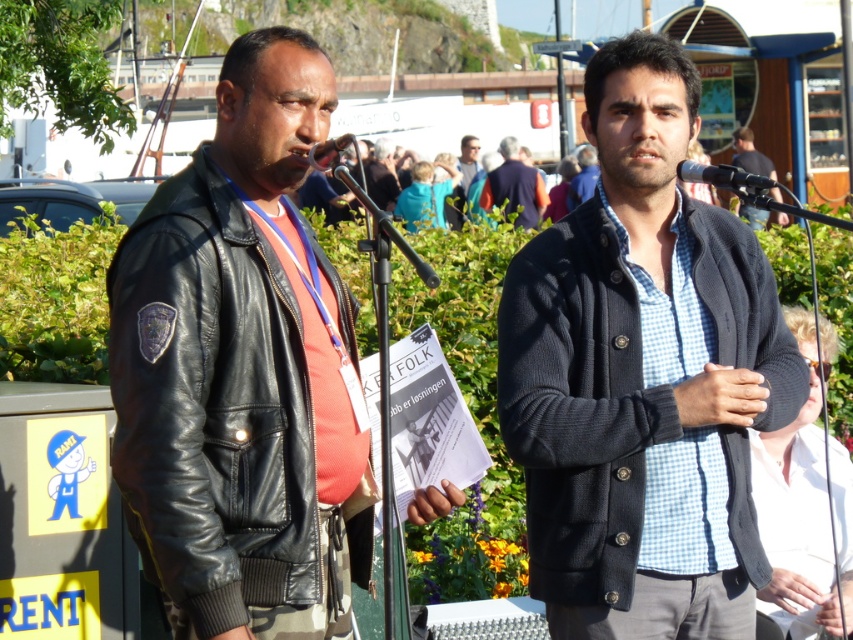
Question: Can you confirm if black leather jacket at upper center is positioned to the left of metallic silver microphone at center?

Choices:
 (A) no
 (B) yes

Answer: (A)

Question: Among these points, which one is farthest from the camera?

Choices:
 (A) (764, 161)
 (B) (254, 496)

Answer: (A)

Question: Which point appears closest to the camera in this image?

Choices:
 (A) (181, 538)
 (B) (788, 488)

Answer: (A)

Question: Does black leather jacket at upper center appear on the right side of metallic silver microphone at center?

Choices:
 (A) no
 (B) yes

Answer: (B)

Question: Considering the relative positions of knitted dark gray sweater at center and black leather jacket at upper center in the image provided, where is knitted dark gray sweater at center located with respect to black leather jacket at upper center?

Choices:
 (A) above
 (B) below

Answer: (B)

Question: Estimate the real-world distances between objects in this image. Which object is farther from the black leather jacket at upper center?

Choices:
 (A) knitted dark gray sweater at center
 (B) matte black jacket at center

Answer: (B)